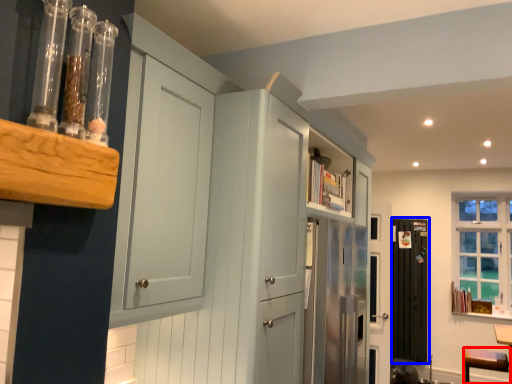
Question: Which point is further to the camera, vanity (highlighted by a red box) or screen door (highlighted by a blue box)?

Choices:
 (A) vanity
 (B) screen door

Answer: (B)